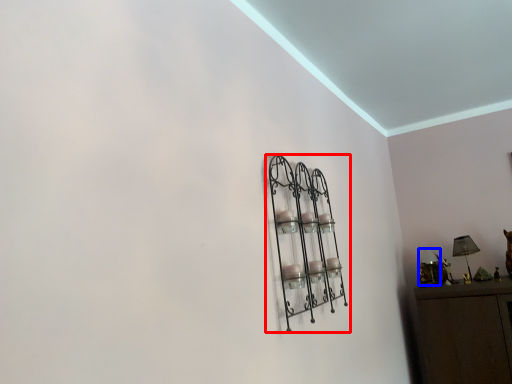
Question: Which object appears closest to the camera in this image, shelf (highlighted by a red box) or lamp (highlighted by a blue box)?

Choices:
 (A) shelf
 (B) lamp

Answer: (A)